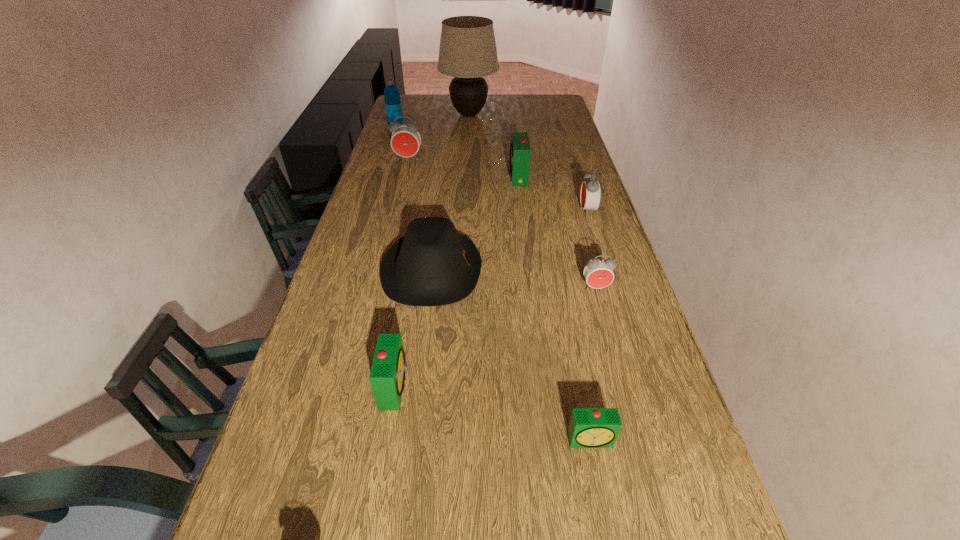
I want to click on free space that satisfies the following two spatial constraints: 1. on the face of the second smallest red alarm clock; 2. on the face of the smallest red alarm clock, so click(x=612, y=288).